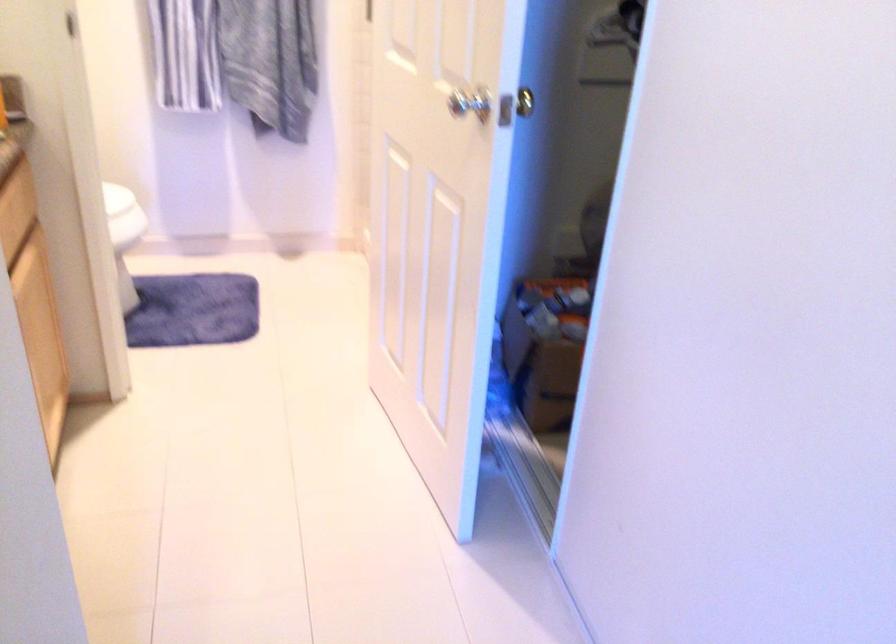
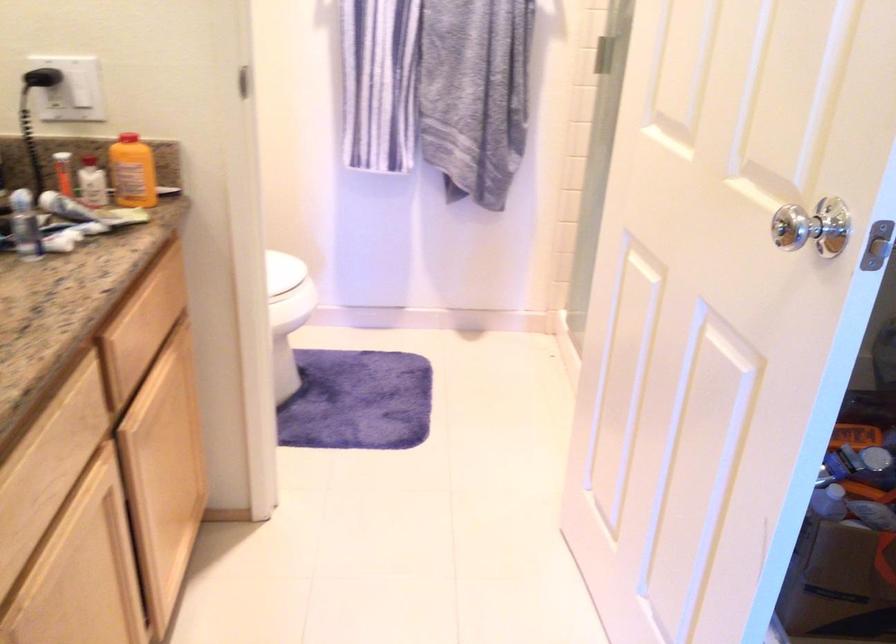
Where in the second image is the point corresponding to (117,200) from the first image?

(282, 270)